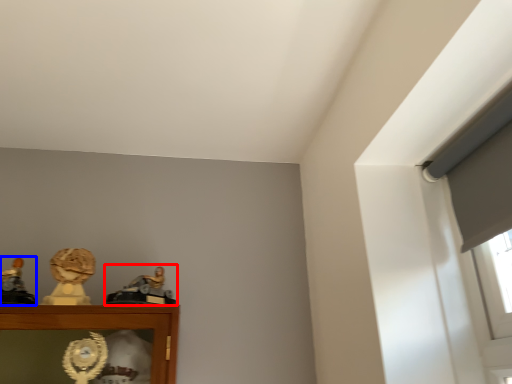
Question: Which of the following is the closest to the observer, character sculpture (highlighted by a red box) or character sculpture (highlighted by a blue box)?

Choices:
 (A) character sculpture
 (B) character sculpture

Answer: (B)